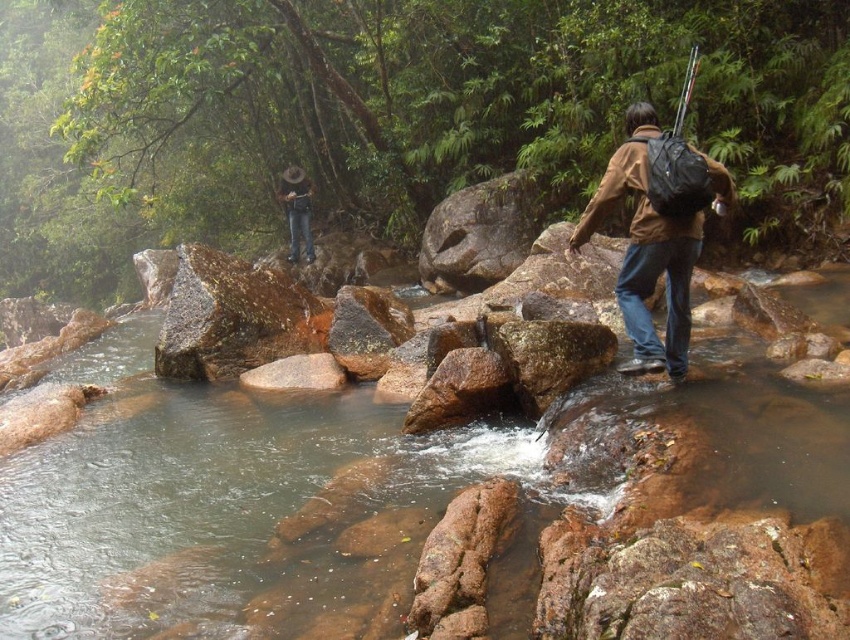
Which is in front, point (459, 477) or point (655, 237)?

Point (459, 477) is in front.

The height and width of the screenshot is (640, 850). In order to click on brown rock at center in this screenshot , I will do `click(205, 504)`.

Is point (656, 273) positioned before point (303, 232)?

That is True.

In order to click on brown matte jacket at center in this screenshot , I will do pos(647,252).

Does point (604, 182) lie behind point (304, 227)?

No, it is not.

Locate an element on the screen. The image size is (850, 640). brown matte jacket at center is located at coordinates (647, 252).

Is brown rock at center above brown leather hat at upper center?

No, brown rock at center is not above brown leather hat at upper center.

Who is taller, brown rock at center or brown leather hat at upper center?

With more height is brown leather hat at upper center.

The width and height of the screenshot is (850, 640). What do you see at coordinates (205, 504) in the screenshot? I see `brown rock at center` at bounding box center [205, 504].

Where is `brown rock at center`? The width and height of the screenshot is (850, 640). brown rock at center is located at coordinates (205, 504).